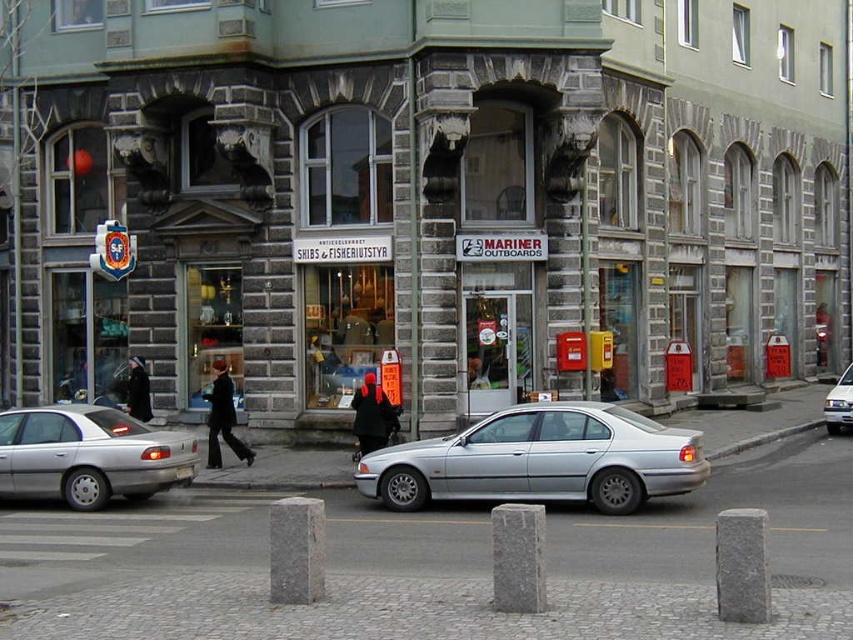
Question: Which object is closer to the camera taking this photo?

Choices:
 (A) white matte van at center
 (B) silver metallic car at center
 (C) black wool coat at center
 (D) black matte coat at center

Answer: (B)

Question: Does silver metallic car at center appear over dark brown leather coat at center?

Choices:
 (A) no
 (B) yes

Answer: (A)

Question: Does silver metallic car at center have a smaller size compared to silver metallic sedan at left?

Choices:
 (A) no
 (B) yes

Answer: (A)

Question: Which of the following is the farthest from the observer?

Choices:
 (A) white matte van at center
 (B) black wool coat at center
 (C) black matte coat at center

Answer: (A)

Question: Which point is farther to the camera?

Choices:
 (A) (641, 417)
 (B) (38, 465)
 (C) (849, 384)

Answer: (C)

Question: Can you confirm if silver metallic sedan at left is bigger than black wool coat at center?

Choices:
 (A) no
 (B) yes

Answer: (B)